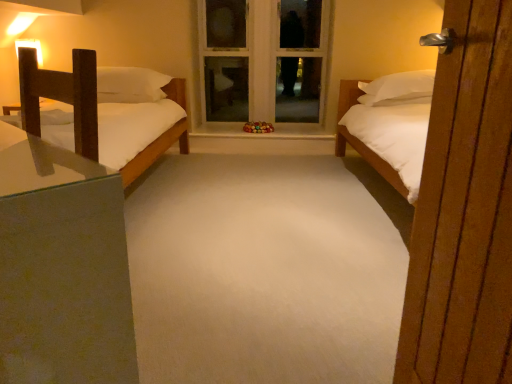
Question: From a real-world perspective, is white painted wood window frame at center positioned above or below wooden nightstand at left?

Choices:
 (A) below
 (B) above

Answer: (B)

Question: Is white painted wood window frame at center wider or thinner than wooden nightstand at left?

Choices:
 (A) wide
 (B) thin

Answer: (B)

Question: Which object is positioned farthest from the white painted wood window frame at center?

Choices:
 (A) wooden nightstand at left
 (B) wooden door at right
 (C) white soft carpet at center

Answer: (A)

Question: Which is nearer to the wooden door at right?

Choices:
 (A) white painted wood window frame at center
 (B) white soft carpet at center
 (C) wooden nightstand at left

Answer: (C)